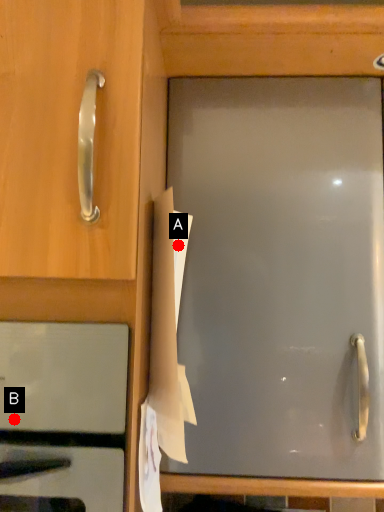
Question: Two points are circled on the image, labeled by A and B beside each circle. Which point is closer to the camera?

Choices:
 (A) A is closer
 (B) B is closer

Answer: (B)